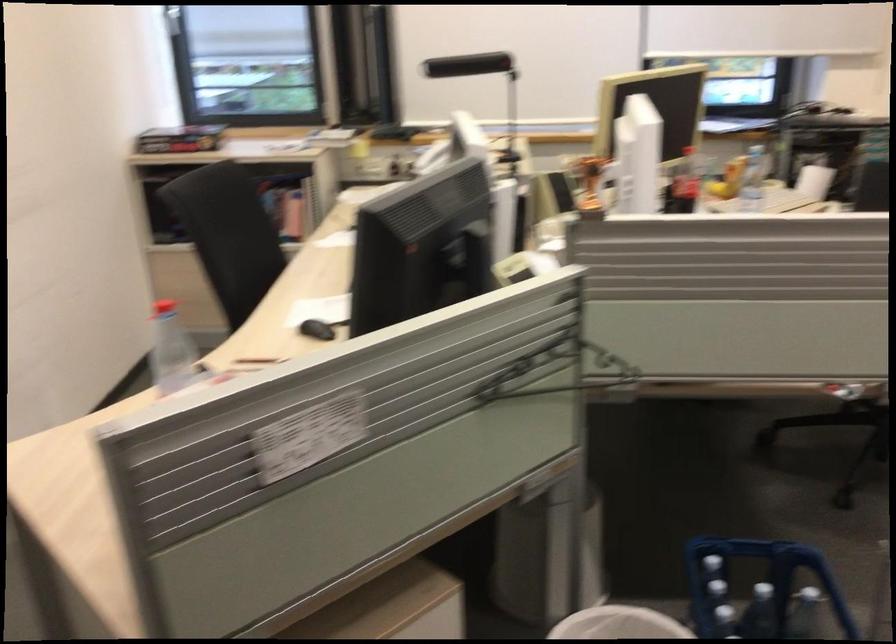
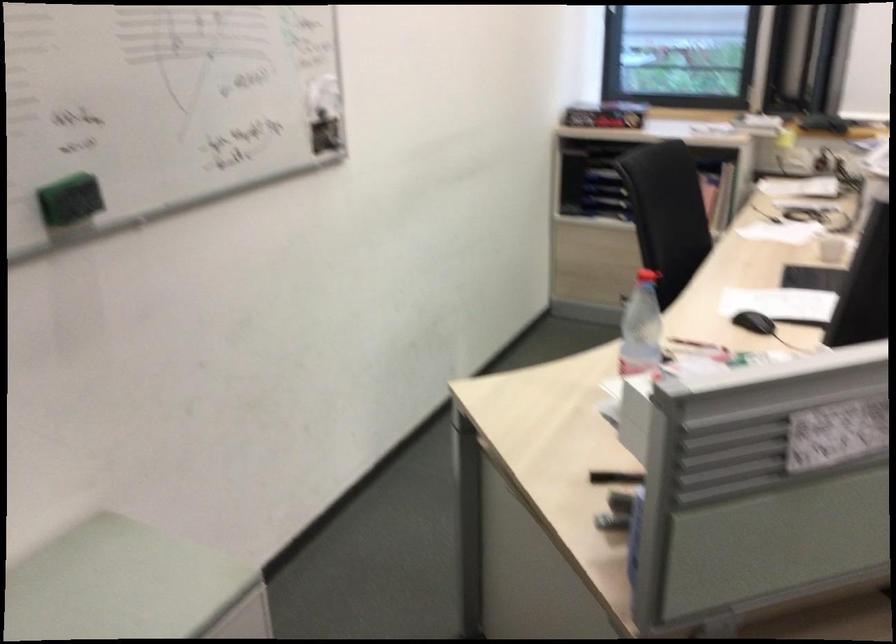
Question: How did the camera likely rotate?

Choices:
 (A) Left
 (B) Right
 (C) Up
 (D) Down

Answer: (A)